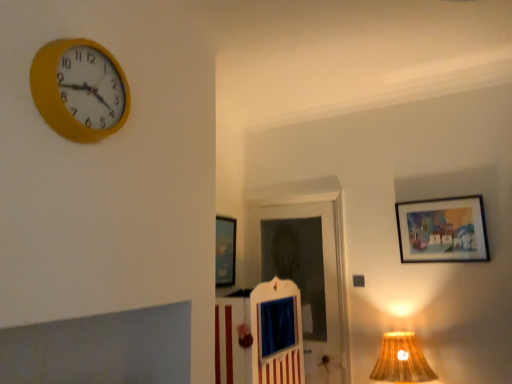
Find the location of `braided fabric lampshade at lower right`. braided fabric lampshade at lower right is located at coordinates (401, 360).

I want to click on matte wooden picture frame at upper right, positioned as the 1th picture frame in right-to-left order, so click(x=442, y=230).

This screenshot has width=512, height=384. I want to click on metallic silver picture frame at center, the 2th picture frame in the front-to-back sequence, so click(225, 251).

The height and width of the screenshot is (384, 512). What are the coordinates of `yellow plastic wall clock at upper left` in the screenshot? It's located at (79, 89).

From a real-world perspective, is matte wooden picture frame at upper right, positioned as the 1th picture frame in right-to-left order, located higher than braided fabric lampshade at lower right?

Yes, from a real-world perspective, matte wooden picture frame at upper right, positioned as the 1th picture frame in right-to-left order, is over braided fabric lampshade at lower right

Is matte wooden picture frame at upper right, which is counted as the 1th picture frame, starting from the front, far away from braided fabric lampshade at lower right?

Actually, matte wooden picture frame at upper right, which is counted as the 1th picture frame, starting from the front, and braided fabric lampshade at lower right are a little close together.

Does matte wooden picture frame at upper right, which is counted as the 1th picture frame, starting from the front, have a larger size compared to braided fabric lampshade at lower right?

No, matte wooden picture frame at upper right, which is counted as the 1th picture frame, starting from the front, is not bigger than braided fabric lampshade at lower right.

Which of these two, matte wooden picture frame at upper right, the second picture frame when ordered from left to right, or braided fabric lampshade at lower right, is wider?

braided fabric lampshade at lower right.

Is yellow plastic wall clock at upper left far away from metallic silver picture frame at center, arranged as the second picture frame when viewed from the right?

Yes.

Considering their positions, is yellow plastic wall clock at upper left located in front of or behind metallic silver picture frame at center, the 2th picture frame in the front-to-back sequence?

In the image, yellow plastic wall clock at upper left appears in front of metallic silver picture frame at center, the 2th picture frame in the front-to-back sequence.

Can you confirm if yellow plastic wall clock at upper left is positioned to the left of metallic silver picture frame at center, arranged as the second picture frame when viewed from the right?

Yes, yellow plastic wall clock at upper left is to the left of metallic silver picture frame at center, arranged as the second picture frame when viewed from the right.

Looking at this image, does yellow plastic wall clock at upper left turn towards metallic silver picture frame at center, arranged as the second picture frame when viewed from the right?

No, yellow plastic wall clock at upper left is not facing towards metallic silver picture frame at center, arranged as the second picture frame when viewed from the right.

Does point (435, 379) lie in front of point (57, 65)?

No.

Can you confirm if braided fabric lampshade at lower right is positioned to the left of yellow plastic wall clock at upper left?

Incorrect, braided fabric lampshade at lower right is not on the left side of yellow plastic wall clock at upper left.

From a real-world perspective, is braided fabric lampshade at lower right beneath yellow plastic wall clock at upper left?

Yes, from a real-world perspective, braided fabric lampshade at lower right is under yellow plastic wall clock at upper left.

Is metallic silver picture frame at center, which is counted as the first picture frame, starting from the left, oriented away from matte wooden picture frame at upper right, positioned as the 1th picture frame in right-to-left order?

No.

Does metallic silver picture frame at center, arranged as the second picture frame when viewed from the right, have a greater width compared to matte wooden picture frame at upper right, arranged as the 2th picture frame when viewed from the back?

Indeed, metallic silver picture frame at center, arranged as the second picture frame when viewed from the right, has a greater width compared to matte wooden picture frame at upper right, arranged as the 2th picture frame when viewed from the back.

From a real-world perspective, is metallic silver picture frame at center, the 2th picture frame in the front-to-back sequence, physically above matte wooden picture frame at upper right, which is counted as the 1th picture frame, starting from the front?

No, from a real-world perspective, metallic silver picture frame at center, the 2th picture frame in the front-to-back sequence, is not above matte wooden picture frame at upper right, which is counted as the 1th picture frame, starting from the front.

Based on the photo, which of these two, metallic silver picture frame at center, the 2th picture frame in the front-to-back sequence, or matte wooden picture frame at upper right, which is counted as the 1th picture frame, starting from the front, is bigger?

metallic silver picture frame at center, the 2th picture frame in the front-to-back sequence, is bigger.

Is braided fabric lampshade at lower right touching matte wooden picture frame at upper right, the second picture frame when ordered from left to right?

braided fabric lampshade at lower right and matte wooden picture frame at upper right, the second picture frame when ordered from left to right, are not in contact.

Is braided fabric lampshade at lower right looking in the opposite direction of matte wooden picture frame at upper right, the second picture frame when ordered from left to right?

No, braided fabric lampshade at lower right is not facing the opposite direction of matte wooden picture frame at upper right, the second picture frame when ordered from left to right.

From the image's perspective, does braided fabric lampshade at lower right appear higher than matte wooden picture frame at upper right, the second picture frame when ordered from left to right?

Actually, braided fabric lampshade at lower right appears below matte wooden picture frame at upper right, the second picture frame when ordered from left to right, in the image.

Is braided fabric lampshade at lower right positioned beyond the bounds of matte wooden picture frame at upper right, which is counted as the 1th picture frame, starting from the front?

braided fabric lampshade at lower right is positioned outside matte wooden picture frame at upper right, which is counted as the 1th picture frame, starting from the front.

Who is bigger, matte wooden picture frame at upper right, which is counted as the 1th picture frame, starting from the front, or yellow plastic wall clock at upper left?

Bigger between the two is yellow plastic wall clock at upper left.

From the image's perspective, is matte wooden picture frame at upper right, which is counted as the 1th picture frame, starting from the front, over yellow plastic wall clock at upper left?

No.

Is yellow plastic wall clock at upper left at the back of matte wooden picture frame at upper right, the second picture frame when ordered from left to right?

No, matte wooden picture frame at upper right, the second picture frame when ordered from left to right, is not facing the opposite direction of yellow plastic wall clock at upper left.

How distant is braided fabric lampshade at lower right from metallic silver picture frame at center, which is counted as the first picture frame, starting from the left?

4.64 feet.

Locate an element on the screen. picture frame that is the 2nd one when counting backward from the braided fabric lampshade at lower right is located at coordinates (225, 251).

From the image's perspective, is braided fabric lampshade at lower right under metallic silver picture frame at center, arranged as the second picture frame when viewed from the right?

Indeed, from the image's perspective, braided fabric lampshade at lower right is shown beneath metallic silver picture frame at center, arranged as the second picture frame when viewed from the right.

Does braided fabric lampshade at lower right lie in front of metallic silver picture frame at center, arranged as the second picture frame when viewed from the right?

Yes, braided fabric lampshade at lower right is closer to the viewer.

Find the location of `table lamp to the left of matte wooden picture frame at upper right, arranged as the 2th picture frame when viewed from the back`. table lamp to the left of matte wooden picture frame at upper right, arranged as the 2th picture frame when viewed from the back is located at coordinates (401, 360).

Identify the location of wall clock above the metallic silver picture frame at center, which ranks as the 1th picture frame in back-to-front order (from a real-world perspective). Image resolution: width=512 pixels, height=384 pixels. (79, 89).

Estimate the real-world distances between objects in this image. Which object is further from white wooden door at center, braided fabric lampshade at lower right or metallic silver picture frame at center, which is counted as the first picture frame, starting from the left?

braided fabric lampshade at lower right is further to white wooden door at center.

Estimate the real-world distances between objects in this image. Which object is closer to yellow plastic wall clock at upper left, metallic silver picture frame at center, which is counted as the first picture frame, starting from the left, or braided fabric lampshade at lower right?

The object closer to yellow plastic wall clock at upper left is metallic silver picture frame at center, which is counted as the first picture frame, starting from the left.

From the image, which object appears to be nearer to matte wooden picture frame at upper right, positioned as the 1th picture frame in right-to-left order, metallic silver picture frame at center, which is counted as the first picture frame, starting from the left, or braided fabric lampshade at lower right?

braided fabric lampshade at lower right is positioned closer to the anchor matte wooden picture frame at upper right, positioned as the 1th picture frame in right-to-left order.

Looking at the image, which one is located further to white wooden door at center, yellow plastic wall clock at upper left or matte wooden picture frame at upper right, the second picture frame when ordered from left to right?

The object further to white wooden door at center is yellow plastic wall clock at upper left.

Estimate the real-world distances between objects in this image. Which object is closer to yellow plastic wall clock at upper left, matte wooden picture frame at upper right, the second picture frame when ordered from left to right, or metallic silver picture frame at center, arranged as the second picture frame when viewed from the right?

Based on the image, metallic silver picture frame at center, arranged as the second picture frame when viewed from the right, appears to be nearer to yellow plastic wall clock at upper left.

From the image, which object appears to be farther from matte wooden picture frame at upper right, arranged as the 2th picture frame when viewed from the back, white wooden door at center or yellow plastic wall clock at upper left?

yellow plastic wall clock at upper left is positioned further to the anchor matte wooden picture frame at upper right, arranged as the 2th picture frame when viewed from the back.

From the image, which object appears to be farther from metallic silver picture frame at center, which ranks as the 1th picture frame in back-to-front order, braided fabric lampshade at lower right or white wooden door at center?

braided fabric lampshade at lower right is positioned further to the anchor metallic silver picture frame at center, which ranks as the 1th picture frame in back-to-front order.

Which object lies nearer to the anchor point metallic silver picture frame at center, which ranks as the 1th picture frame in back-to-front order, white wooden door at center or yellow plastic wall clock at upper left?

white wooden door at center is closer to metallic silver picture frame at center, which ranks as the 1th picture frame in back-to-front order.

Where is `door situated between yellow plastic wall clock at upper left and matte wooden picture frame at upper right, positioned as the 1th picture frame in right-to-left order, from left to right`? Image resolution: width=512 pixels, height=384 pixels. door situated between yellow plastic wall clock at upper left and matte wooden picture frame at upper right, positioned as the 1th picture frame in right-to-left order, from left to right is located at coordinates (306, 277).

Where is `door between yellow plastic wall clock at upper left and metallic silver picture frame at center, which ranks as the 1th picture frame in back-to-front order, from front to back`? The image size is (512, 384). door between yellow plastic wall clock at upper left and metallic silver picture frame at center, which ranks as the 1th picture frame in back-to-front order, from front to back is located at coordinates (306, 277).

Where is `table lamp between metallic silver picture frame at center, which is counted as the first picture frame, starting from the left, and matte wooden picture frame at upper right, positioned as the 1th picture frame in right-to-left order`? table lamp between metallic silver picture frame at center, which is counted as the first picture frame, starting from the left, and matte wooden picture frame at upper right, positioned as the 1th picture frame in right-to-left order is located at coordinates (401, 360).

Identify the location of door between metallic silver picture frame at center, arranged as the second picture frame when viewed from the right, and matte wooden picture frame at upper right, arranged as the 2th picture frame when viewed from the back, from left to right. The height and width of the screenshot is (384, 512). [306, 277].